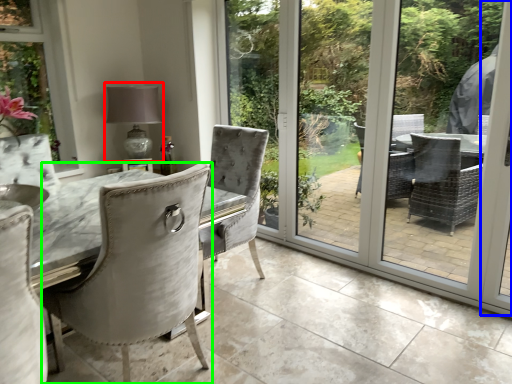
Question: Estimate the real-world distances between objects in this image. Which object is closer to table lamp (highlighted by a red box), screen door (highlighted by a blue box) or chair (highlighted by a green box)?

Choices:
 (A) screen door
 (B) chair

Answer: (B)